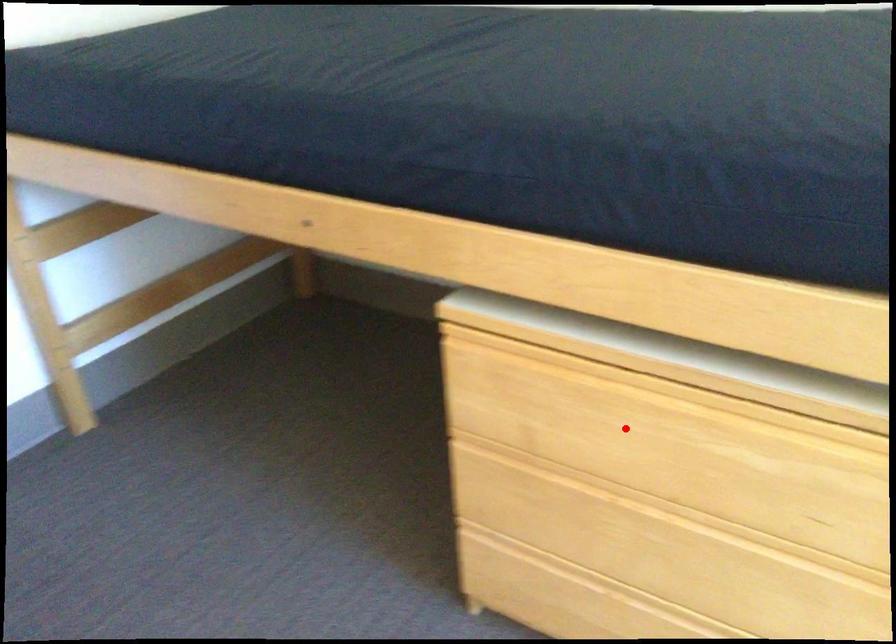
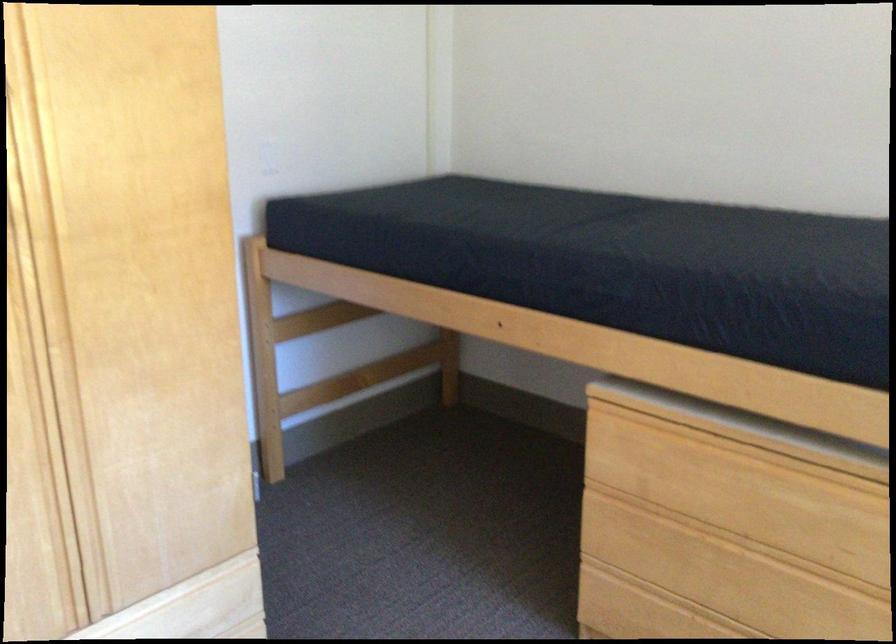
Locate, in the second image, the point that corresponds to the highlighted location in the first image.

(728, 488)